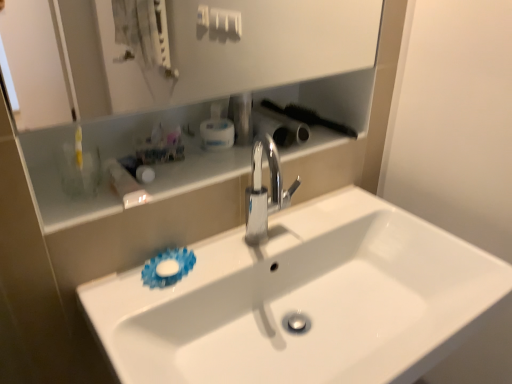
Question: Would you consider white glossy shelf at upper center to be distant from white glossy sink at center?

Choices:
 (A) yes
 (B) no

Answer: (B)

Question: From the image's perspective, does white glossy shelf at upper center appear higher than white glossy sink at center?

Choices:
 (A) no
 (B) yes

Answer: (B)

Question: Does white glossy shelf at upper center have a greater width compared to white glossy sink at center?

Choices:
 (A) no
 (B) yes

Answer: (A)

Question: Is white glossy shelf at upper center at the left side of white glossy sink at center?

Choices:
 (A) yes
 (B) no

Answer: (A)

Question: From the image's perspective, is white glossy shelf at upper center below white glossy sink at center?

Choices:
 (A) yes
 (B) no

Answer: (B)

Question: Looking at their shapes, would you say white glossy shelf at upper center is wider or thinner than white plastic mouthwash at upper center?

Choices:
 (A) thin
 (B) wide

Answer: (B)

Question: Is point (176, 109) positioned closer to the camera than point (209, 127)?

Choices:
 (A) farther
 (B) closer

Answer: (A)

Question: Visually, is white glossy shelf at upper center positioned to the left or to the right of white plastic mouthwash at upper center?

Choices:
 (A) left
 (B) right

Answer: (A)

Question: In the image, is white glossy shelf at upper center positioned in front of or behind white plastic mouthwash at upper center?

Choices:
 (A) front
 (B) behind

Answer: (A)

Question: In the image, is white glossy sink at center positioned in front of or behind polished chrome faucet at center?

Choices:
 (A) behind
 (B) front

Answer: (B)

Question: From a real-world perspective, relative to polished chrome faucet at center, is white glossy sink at center vertically above or below?

Choices:
 (A) above
 (B) below

Answer: (B)

Question: Looking at their shapes, would you say white glossy sink at center is wider or thinner than polished chrome faucet at center?

Choices:
 (A) wide
 (B) thin

Answer: (A)

Question: From the image's perspective, relative to polished chrome faucet at center, is white glossy sink at center above or below?

Choices:
 (A) above
 (B) below

Answer: (B)

Question: Is point (274, 114) positioned closer to the camera than point (301, 112)?

Choices:
 (A) closer
 (B) farther

Answer: (A)

Question: Considering the positions of black plastic brush at upper right, which is the 2th brush from right to left, and black plastic brush at upper right, the second brush positioned from the left, in the image, is black plastic brush at upper right, which is the 2th brush from right to left, taller or shorter than black plastic brush at upper right, the second brush positioned from the left,?

Choices:
 (A) short
 (B) tall

Answer: (A)